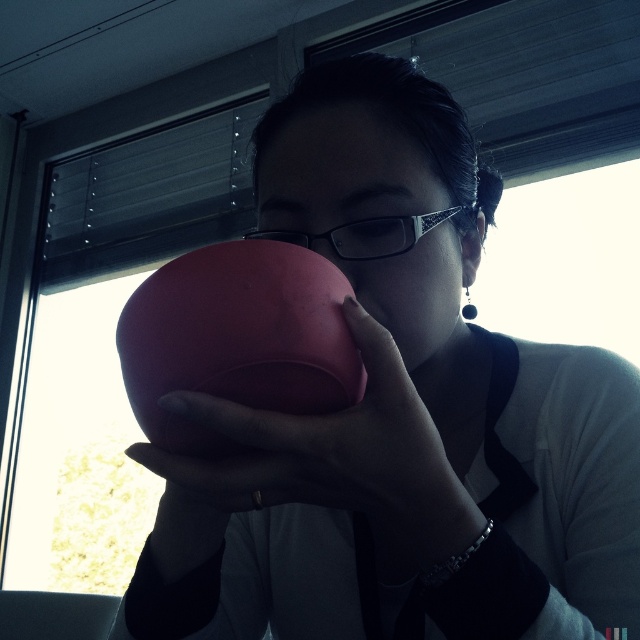
Question: Which object appears closest to the camera in this image?

Choices:
 (A) matte pink cup at center
 (B) matte pink piggy bank at center

Answer: (A)

Question: Can you confirm if matte pink bowl at center is wider than matte pink piggy bank at center?

Choices:
 (A) yes
 (B) no

Answer: (A)

Question: In this image, where is matte pink cup at center located relative to matte pink piggy bank at center?

Choices:
 (A) left
 (B) right

Answer: (B)

Question: Which object is the farthest from the matte pink piggy bank at center?

Choices:
 (A) matte pink bowl at center
 (B) matte pink cup at center

Answer: (A)

Question: Among these objects, which one is farthest from the camera?

Choices:
 (A) matte pink bowl at center
 (B) matte pink piggy bank at center
 (C) matte pink cup at center

Answer: (B)

Question: Does matte pink cup at center have a larger size compared to matte pink piggy bank at center?

Choices:
 (A) no
 (B) yes

Answer: (B)